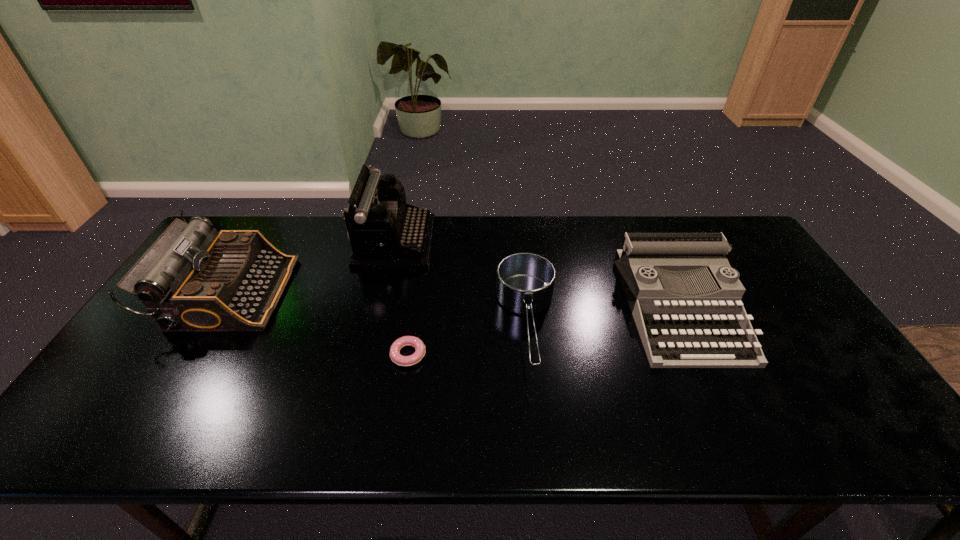
In order to click on the second typewriter from right to left in this screenshot , I will do point(385,233).

This screenshot has height=540, width=960. Find the location of `the tallest object`. the tallest object is located at coordinates (385, 233).

Identify the location of the leftmost typewriter. The width and height of the screenshot is (960, 540). (192, 279).

Identify the location of the second shortest typewriter. The width and height of the screenshot is (960, 540). (192, 279).

Identify the location of the rightmost typewriter. (711, 329).

At what (x,y) coordinates should I click in order to perform the action: click on the rightmost object. Please return your answer as a coordinate pair (x, y). The height and width of the screenshot is (540, 960). Looking at the image, I should click on (711, 329).

Identify the location of saucepan. (525, 281).

You are a GUI agent. You are given a task and a screenshot of the screen. Output one action in this format:
    pyautogui.click(x=<x>, y=<y>)
    Task: Click on the second object from right to left
    The image size is (960, 540).
    Given the screenshot: What is the action you would take?
    pyautogui.click(x=525, y=281)

This screenshot has width=960, height=540. Identify the location of doughnut. point(406,361).

Identify the location of free spot located on the typing side of the tallest typewriter. (523, 241).